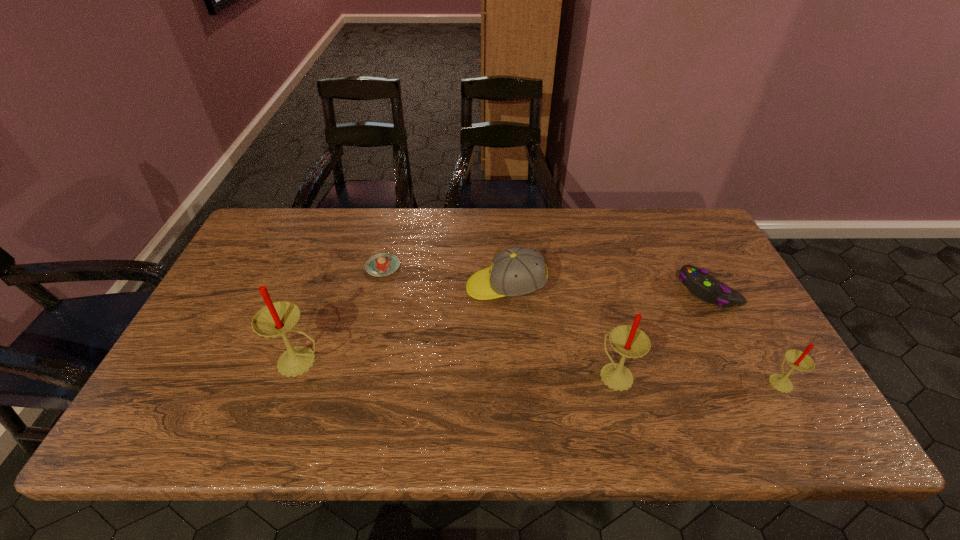
This screenshot has height=540, width=960. I want to click on free space that satisfies the following two spatial constraints: 1. on the front-facing side of the fourth tallest object; 2. on the back side of the fifth tallest object, so click(x=506, y=291).

Where is `vacant space that satisfies the following two spatial constraints: 1. on the front-facing side of the baseball cap; 2. on the right side of the second tallest object`? The image size is (960, 540). vacant space that satisfies the following two spatial constraints: 1. on the front-facing side of the baseball cap; 2. on the right side of the second tallest object is located at coordinates (511, 374).

This screenshot has height=540, width=960. I want to click on free location that satisfies the following two spatial constraints: 1. on the front side of the shortest candle; 2. on the right side of the fourth object from left to right, so click(617, 381).